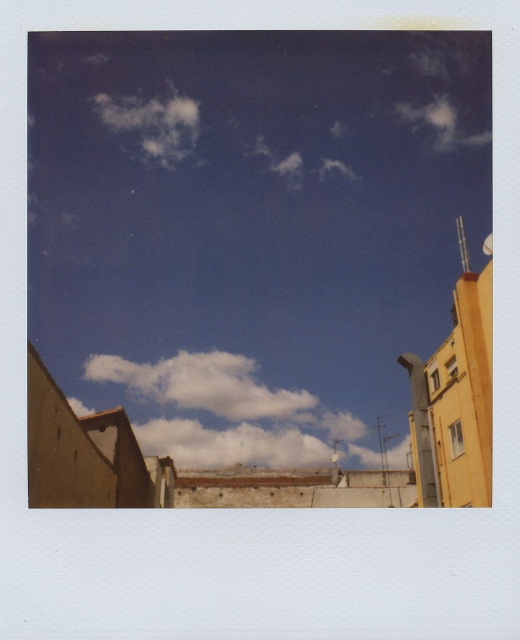
You are looking at the sky and see two clouds, the white fluffy cloud at center and the white fluffy cloud at upper left. Which cloud is lower in the sky?

The white fluffy cloud at center is lower in the sky because it is shorter than the white fluffy cloud at upper left.

You are an airplane pilot flying at a high altitude. You notice two clouds in the sky ahead of you. One is the white fluffy cloud at center and the other is the white fluffy cloud at upper left. Which cloud do you need to avoid more due to its size?

The white fluffy cloud at center is larger in size than the white fluffy cloud at upper left, so you should avoid the white fluffy cloud at center more due to its size.